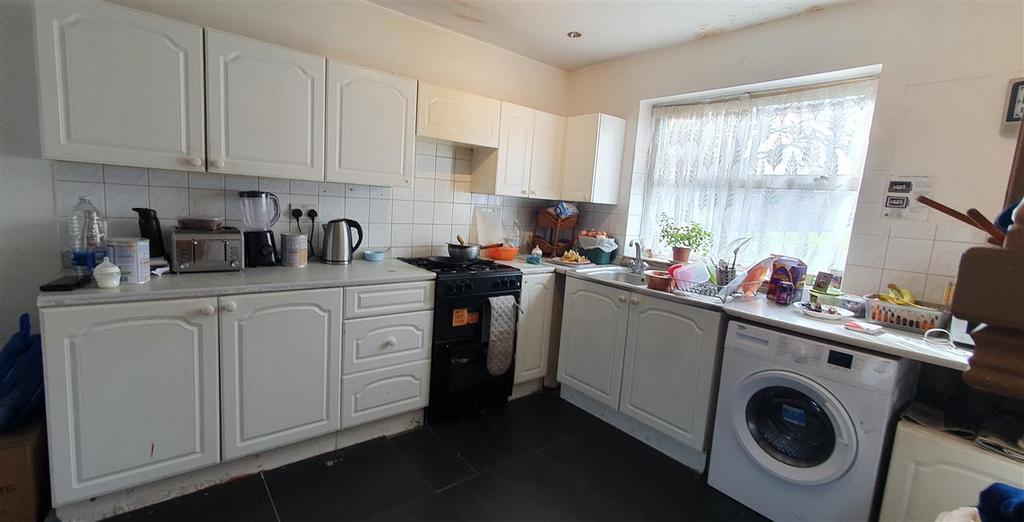
The width and height of the screenshot is (1024, 522). I want to click on blender, so click(260, 217).